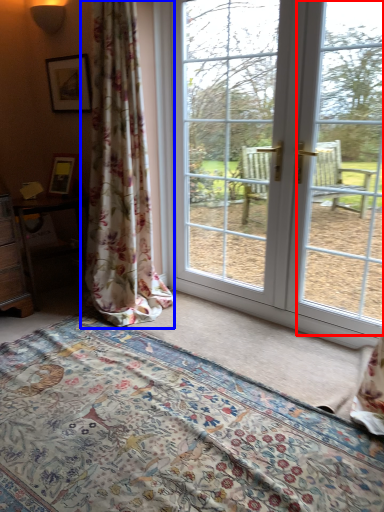
Question: Among these objects, which one is nearest to the camera, window screen (highlighted by a red box) or curtain (highlighted by a blue box)?

Choices:
 (A) window screen
 (B) curtain

Answer: (A)